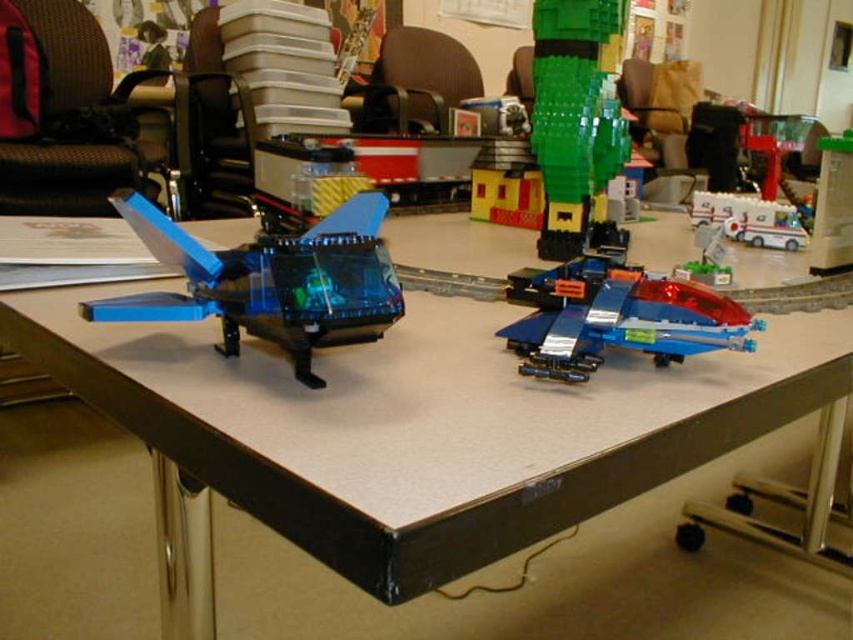
Question: Which point is closer to the camera taking this photo?

Choices:
 (A) (746, 324)
 (B) (592, 218)

Answer: (A)

Question: Estimate the real-world distances between objects in this image. Which object is farther from the green lego figure at upper right?

Choices:
 (A) translucent plastic spaceship at center
 (B) white plastic ambulance at center-right
 (C) translucent blue plastic spaceship at center
 (D) smooth gray table at center

Answer: (C)

Question: Can you confirm if transparent plastic spaceship at left is positioned to the right of translucent plastic spaceship at center?

Choices:
 (A) yes
 (B) no

Answer: (B)

Question: Does green lego figure at upper right come behind translucent plastic spaceship at center?

Choices:
 (A) yes
 (B) no

Answer: (A)

Question: Is smooth gray table at center thinner than green lego figure at upper right?

Choices:
 (A) no
 (B) yes

Answer: (A)

Question: Estimate the real-world distances between objects in this image. Which object is closer to the translucent plastic spaceship at center?

Choices:
 (A) green lego figure at upper right
 (B) transparent plastic spaceship at left

Answer: (A)